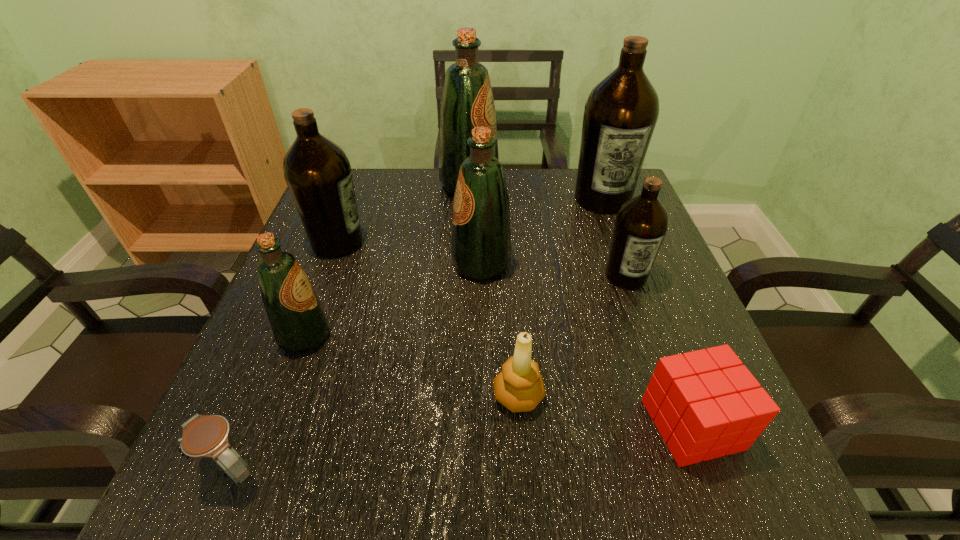
Locate an element on the screen. The height and width of the screenshot is (540, 960). green olive oil that is the second closest to the gray watch is located at coordinates (481, 240).

You are a GUI agent. You are given a task and a screenshot of the screen. Output one action in this format:
    pyautogui.click(x=<x>, y=<y>)
    Task: Click on the second closest green olive oil to the leftmost green olive oil
    Image resolution: width=960 pixels, height=540 pixels.
    Given the screenshot: What is the action you would take?
    pyautogui.click(x=467, y=101)

The width and height of the screenshot is (960, 540). Find the location of `free spot that satisfies the following two spatial constraints: 1. on the label of the cube; 2. on the right side of the farthest brown olive oil`. free spot that satisfies the following two spatial constraints: 1. on the label of the cube; 2. on the right side of the farthest brown olive oil is located at coordinates (684, 424).

Where is `vacant region that satisfies the following two spatial constraints: 1. on the front-facing side of the second nearest green olive oil; 2. on the left side of the red cube`? Image resolution: width=960 pixels, height=540 pixels. vacant region that satisfies the following two spatial constraints: 1. on the front-facing side of the second nearest green olive oil; 2. on the left side of the red cube is located at coordinates (482, 424).

At what (x,y) coordinates should I click in order to perform the action: click on vacant point that satisfies the following two spatial constraints: 1. on the label of the red cube; 2. on the left side of the nearest brown olive oil. Please return your answer as a coordinate pair (x, y). Looking at the image, I should click on (679, 424).

At what (x,y) coordinates should I click in order to perform the action: click on vacant space that satisfies the following two spatial constraints: 1. on the label of the second smallest brown olive oil; 2. on the back side of the red cube. Please return your answer as a coordinate pair (x, y). The height and width of the screenshot is (540, 960). Looking at the image, I should click on (269, 424).

Image resolution: width=960 pixels, height=540 pixels. Find the location of `free space that satisfies the following two spatial constraints: 1. on the front-facing side of the candle_holder; 2. on the right side of the biggest green olive oil`. free space that satisfies the following two spatial constraints: 1. on the front-facing side of the candle_holder; 2. on the right side of the biggest green olive oil is located at coordinates (463, 396).

Identify the location of free space in the image that satisfies the following two spatial constraints: 1. on the label of the cube; 2. on the right side of the smallest brown olive oil. tap(679, 424).